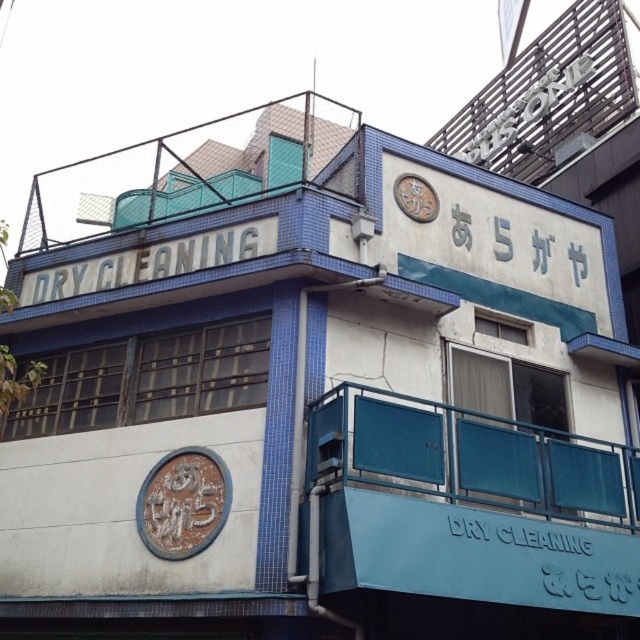
Who is more forward, (515,436) or (420,189)?

Point (515,436)

Between teal glass balcony at lower right and brown textured clock at upper center, which one has more height?

With more height is teal glass balcony at lower right.

What are the coordinates of `teal glass balcony at lower right` in the screenshot? It's located at (467, 506).

Locate an element on the screen. This screenshot has height=640, width=640. teal glass balcony at lower right is located at coordinates (467, 506).

Between teal glass balcony at lower right and white metallic sign at center, which one appears on the left side from the viewer's perspective?

Positioned to the left is teal glass balcony at lower right.

Does teal glass balcony at lower right have a lesser height compared to white metallic sign at center?

No.

Is point (579, 580) positioned before point (586, 554)?

That is True.

Identify the location of teal glass balcony at lower right. (467, 506).

The width and height of the screenshot is (640, 640). I want to click on white painted metal sign at upper center, so click(150, 260).

Is point (100, 269) farther from camera compared to point (499, 525)?

That is True.

This screenshot has height=640, width=640. I want to click on white painted metal sign at upper center, so click(150, 260).